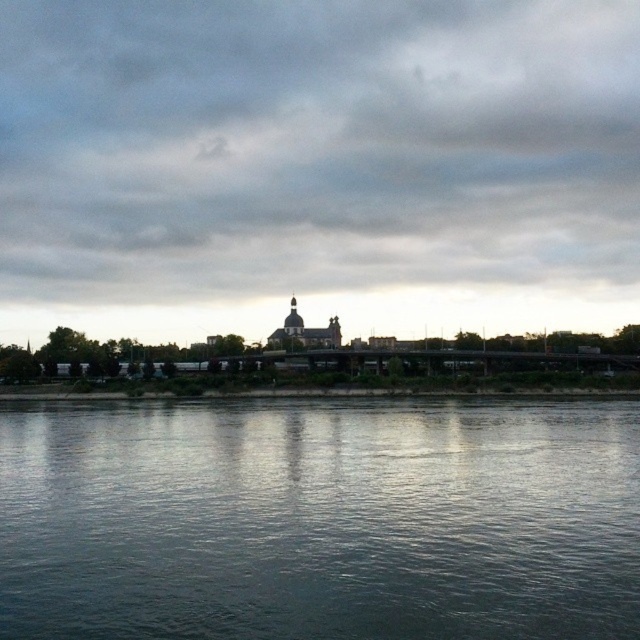
Question: Does cloudy sky at upper center appear on the left side of blue water at lower center?

Choices:
 (A) yes
 (B) no

Answer: (A)

Question: Among these points, which one is farthest from the camera?

Choices:
 (A) (134, 568)
 (B) (328, 81)

Answer: (B)

Question: Is cloudy sky at upper center smaller than blue water at lower center?

Choices:
 (A) yes
 (B) no

Answer: (B)

Question: Which point is farther from the camera taking this photo?

Choices:
 (A) (604, 60)
 (B) (346, 557)

Answer: (A)

Question: Which point is closer to the camera?

Choices:
 (A) (20, 611)
 (B) (58, 61)

Answer: (A)

Question: Can you confirm if cloudy sky at upper center is thinner than blue water at lower center?

Choices:
 (A) yes
 (B) no

Answer: (B)